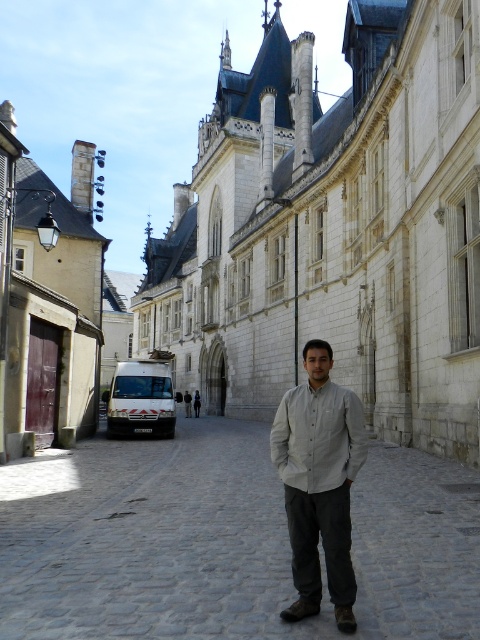
You are standing at the point labeled as point (x=225, y=541) in the image. What is the object located at this coordinate?

The point (x=225, y=541) corresponds to the gray cobblestone alley at center.

You are a tourist in a historic town and want to take a photo of the white stone building at center and the matte red door at left. Since you want both in the frame, do you need to zoom in or zoom out?

The white stone building at center is much taller than the matte red door at left, so to include both in the frame, you should zoom out to capture the entire height of the white stone building at center while still including the matte red door at left.

You are a tourist in this historic town and want to take a photo of the matte red door at left while standing on the gray cobblestone alley at center. Can you do this without moving from your current position?

The gray cobblestone alley at center is located below the matte red door at left, so yes, you can take a photo of the matte red door at left while standing on the gray cobblestone alley at center without moving from your current position.